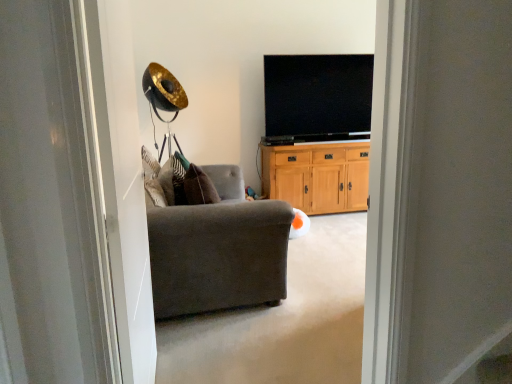
Question: Is dark gray fabric armchair at center facing towards flat screen tv at upper center?

Choices:
 (A) yes
 (B) no

Answer: (B)

Question: Considering the relative positions of dark gray fabric armchair at center and flat screen tv at upper center in the image provided, is dark gray fabric armchair at center in front of flat screen tv at upper center?

Choices:
 (A) no
 (B) yes

Answer: (B)

Question: Considering the relative sizes of dark gray fabric armchair at center and flat screen tv at upper center in the image provided, is dark gray fabric armchair at center shorter than flat screen tv at upper center?

Choices:
 (A) yes
 (B) no

Answer: (A)

Question: From the image's perspective, is dark gray fabric armchair at center beneath flat screen tv at upper center?

Choices:
 (A) yes
 (B) no

Answer: (A)

Question: From a real-world perspective, is dark gray fabric armchair at center located beneath flat screen tv at upper center?

Choices:
 (A) yes
 (B) no

Answer: (A)

Question: From the image's perspective, is wooden cabinet at center located above or below flat screen tv at upper center?

Choices:
 (A) above
 (B) below

Answer: (B)

Question: From a real-world perspective, is wooden cabinet at center physically located above or below flat screen tv at upper center?

Choices:
 (A) above
 (B) below

Answer: (B)

Question: Considering the positions of wooden cabinet at center and flat screen tv at upper center in the image, is wooden cabinet at center taller or shorter than flat screen tv at upper center?

Choices:
 (A) tall
 (B) short

Answer: (B)

Question: Is point (330, 173) positioned closer to the camera than point (290, 100)?

Choices:
 (A) closer
 (B) farther

Answer: (B)

Question: Is transparent glass screen door at left inside the boundaries of wooden cabinet at center, or outside?

Choices:
 (A) inside
 (B) outside

Answer: (B)

Question: Considering the positions of transparent glass screen door at left and wooden cabinet at center in the image, is transparent glass screen door at left taller or shorter than wooden cabinet at center?

Choices:
 (A) tall
 (B) short

Answer: (A)

Question: Looking at their shapes, would you say transparent glass screen door at left is wider or thinner than wooden cabinet at center?

Choices:
 (A) wide
 (B) thin

Answer: (B)

Question: From the image's perspective, relative to wooden cabinet at center, is transparent glass screen door at left above or below?

Choices:
 (A) above
 (B) below

Answer: (B)

Question: Do you think dark gray fabric armchair at center is within flat screen tv at upper center, or outside of it?

Choices:
 (A) inside
 (B) outside

Answer: (B)

Question: From a real-world perspective, is dark gray fabric armchair at center physically located above or below flat screen tv at upper center?

Choices:
 (A) above
 (B) below

Answer: (B)